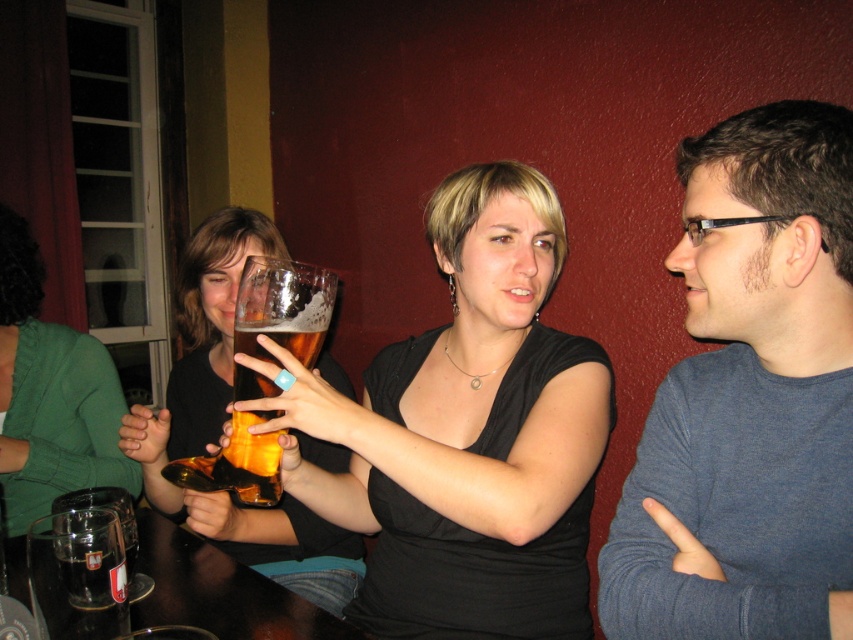
Question: Is translucent glass mug at center thinner than green fabric shirt at left?

Choices:
 (A) no
 (B) yes

Answer: (A)

Question: Which of the following is the closest to the observer?

Choices:
 (A) matte blue sweater at right
 (B) clear glass mug at lower left

Answer: (A)

Question: Which of the following is the closest to the observer?

Choices:
 (A) (770, 195)
 (B) (103, 486)

Answer: (A)

Question: Among these points, which one is nearest to the camera?

Choices:
 (A) (x=235, y=294)
 (B) (x=117, y=378)
 (C) (x=793, y=497)
 (D) (x=135, y=544)

Answer: (C)

Question: Can you confirm if green fabric shirt at left is positioned below clear glass mug at lower left?

Choices:
 (A) yes
 (B) no

Answer: (B)

Question: Can you confirm if clear glass mug at lower left is positioned below translucent glass mug at lower left?

Choices:
 (A) no
 (B) yes

Answer: (A)